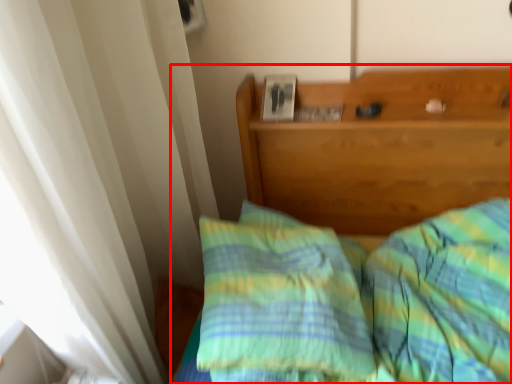
Question: Considering the relative positions of bed (annotated by the red box) and pillow in the image provided, where is bed (annotated by the red box) located with respect to the staircase?

Choices:
 (A) right
 (B) left

Answer: (A)